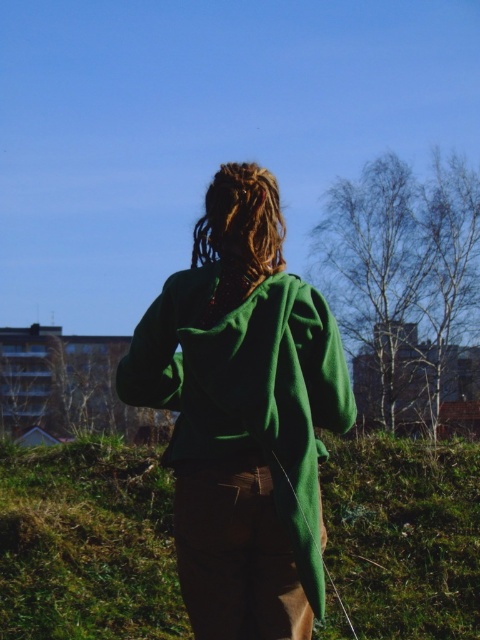
You are a fashion designer observing the person in the image. You need to determine which of the two green items, the green fleece jacket at center or the green fabric at center, is longer in height. Which one is taller?

The green fleece jacket at center is much taller than the green fabric at center.

You are a fashion designer observing the person in the image. You need to determine if the green fabric at center can be attached to the green fleece jacket at center without overlapping. Given that the minimum required space between them for sewing is 12 feet, is this possible?

The green fleece jacket at center and green fabric at center are 14.34 feet apart from each other, which exceeds the 12 feet minimum requirement. Therefore, the green fabric at center can be attached to the green fleece jacket at center without overlapping.